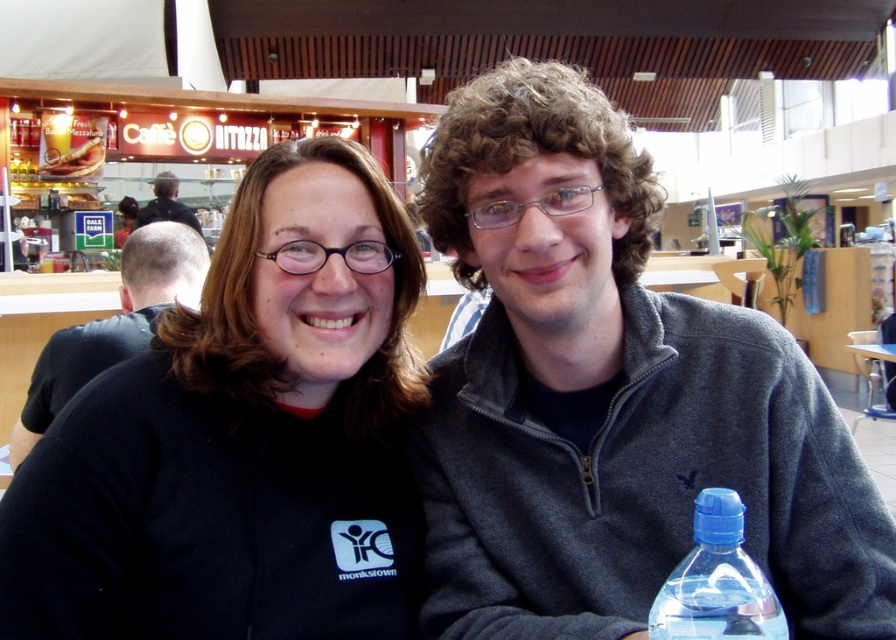
Question: Is the position of black fleece jacket at center more distant than that of transparent plastic bottle at lower right?

Choices:
 (A) yes
 (B) no

Answer: (A)

Question: Which point is closer to the camera?

Choices:
 (A) transparent plastic bottle at lower right
 (B) gray fleece sweater at center

Answer: (A)

Question: Which is farther from the gray fleece sweater at center?

Choices:
 (A) dark gray fleece jacket at left
 (B) transparent plastic bottle at lower right
 (C) black fleece jacket at center
 (D) dark brown hair at upper left

Answer: (D)

Question: Is black fleece jacket at center to the left of dark gray fleece jacket at left from the viewer's perspective?

Choices:
 (A) no
 (B) yes

Answer: (A)

Question: Does black fleece jacket at center have a smaller size compared to dark brown hair at upper left?

Choices:
 (A) yes
 (B) no

Answer: (A)

Question: Which of the following is the farthest from the observer?

Choices:
 (A) (200, 230)
 (B) (703, 552)
 (C) (75, 333)

Answer: (A)